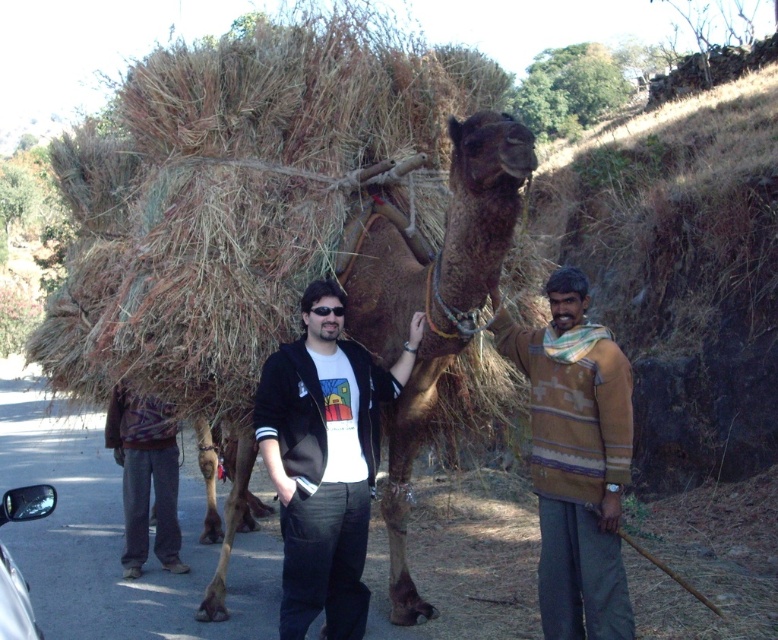
Is black cotton jacket at center taller than woolen sweater at center?

Correct, black cotton jacket at center is much taller as woolen sweater at center.

Measure the distance between point [349,497] and camera.

The distance of point [349,497] from camera is 3.99 meters.

Is point (363, 355) less distant than point (556, 390)?

No, (363, 355) is further to viewer.

Locate an element on the screen. This screenshot has height=640, width=778. black cotton jacket at center is located at coordinates (324, 460).

From the picture: Can you confirm if woolen sweater at center is positioned to the right of dark gray pants at center?

Correct, you'll find woolen sweater at center to the right of dark gray pants at center.

Does woolen sweater at center come behind dark gray pants at center?

That is False.

Is point (559, 403) positioned before point (128, 577)?

Yes.

Locate an element on the screen. This screenshot has height=640, width=778. woolen sweater at center is located at coordinates (575, 460).

Between point (437, 355) and point (132, 449), which one is positioned in front?

Point (437, 355)

Who is positioned more to the right, brown rough camel at center or dark gray pants at center?

From the viewer's perspective, brown rough camel at center appears more on the right side.

Is point (373, 296) positioned after point (135, 458)?

No.

Where is `brown rough camel at center`? The height and width of the screenshot is (640, 778). brown rough camel at center is located at coordinates (430, 300).